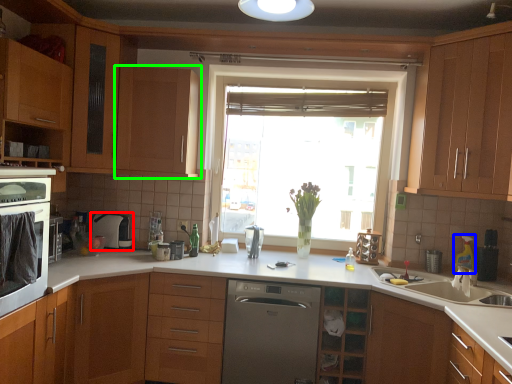
Question: Which is farther away from appliance (highlighted by a red box)? appliance (highlighted by a blue box) or cabinetry (highlighted by a green box)?

Choices:
 (A) appliance
 (B) cabinetry

Answer: (A)